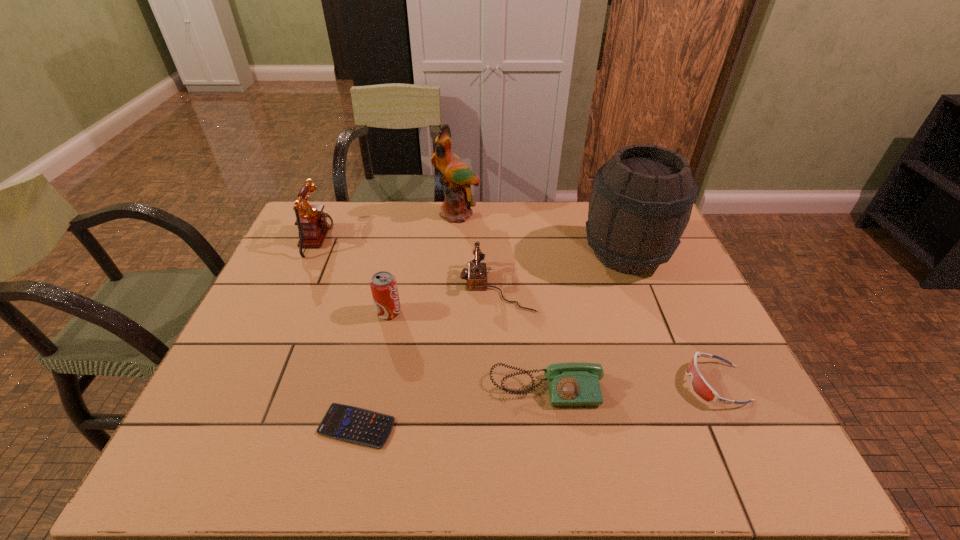
Where is `parrot`? parrot is located at coordinates (457, 177).

The width and height of the screenshot is (960, 540). Find the location of `wine bucket`. wine bucket is located at coordinates (641, 203).

You are a GUI agent. You are given a task and a screenshot of the screen. Output one action in this format:
    pyautogui.click(x=<x>, y=<y>)
    Task: Click on the leftmost object
    This screenshot has width=960, height=540.
    Given the screenshot: What is the action you would take?
    pyautogui.click(x=313, y=224)

Where is `the sixth shortest object`? the sixth shortest object is located at coordinates (313, 224).

At what (x,y) coordinates should I click in order to perform the action: click on soda can. Please return your answer as a coordinate pair (x, y). The width and height of the screenshot is (960, 540). Looking at the image, I should click on (383, 284).

You are a GUI agent. You are given a task and a screenshot of the screen. Output one action in this format:
    pyautogui.click(x=<x>, y=<y>)
    Task: Click on the fifth tallest object
    This screenshot has height=540, width=960.
    Given the screenshot: What is the action you would take?
    pyautogui.click(x=476, y=275)

This screenshot has width=960, height=540. Identify the location of the second farthest telephone. (476, 275).

Where is `the third shortest object`? This screenshot has height=540, width=960. the third shortest object is located at coordinates (575, 383).

Where is `the nearest telephone`? The image size is (960, 540). the nearest telephone is located at coordinates [575, 383].

You are a GUI agent. You are given a task and a screenshot of the screen. Output one action in this format:
    pyautogui.click(x=<x>, y=<y>)
    Task: Click on the goggles
    This screenshot has width=960, height=540.
    Given the screenshot: What is the action you would take?
    pyautogui.click(x=700, y=386)